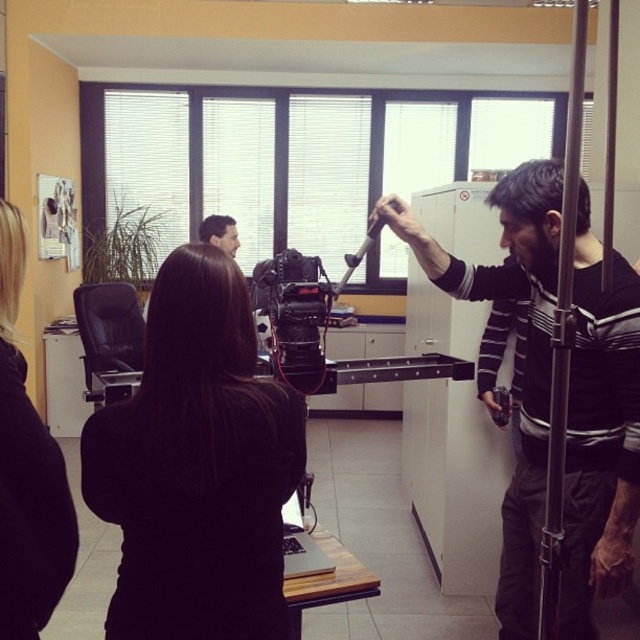
Question: Can you confirm if black matte hair at upper center is positioned below black matte video camera at center?

Choices:
 (A) no
 (B) yes

Answer: (B)

Question: Which point is closer to the camera?

Choices:
 (A) striped sweater at right
 (B) matte black camera at upper center

Answer: (A)

Question: Is striped sweater at right positioned before black matte video camera at center?

Choices:
 (A) yes
 (B) no

Answer: (A)

Question: Among these points, which one is farthest from the camera?

Choices:
 (A) pos(547,234)
 (B) pos(317,312)
 (C) pos(212,227)
 (D) pos(227,356)

Answer: (C)

Question: Estimate the real-world distances between objects in this image. Which object is farther from the matte black camera at upper center?

Choices:
 (A) black matte hair at upper center
 (B) black matte hair at center
 (C) dark brown hair at upper right
 (D) black matte video camera at center

Answer: (A)

Question: Is striped sweater at right wider than matte black camera at upper center?

Choices:
 (A) no
 (B) yes

Answer: (B)